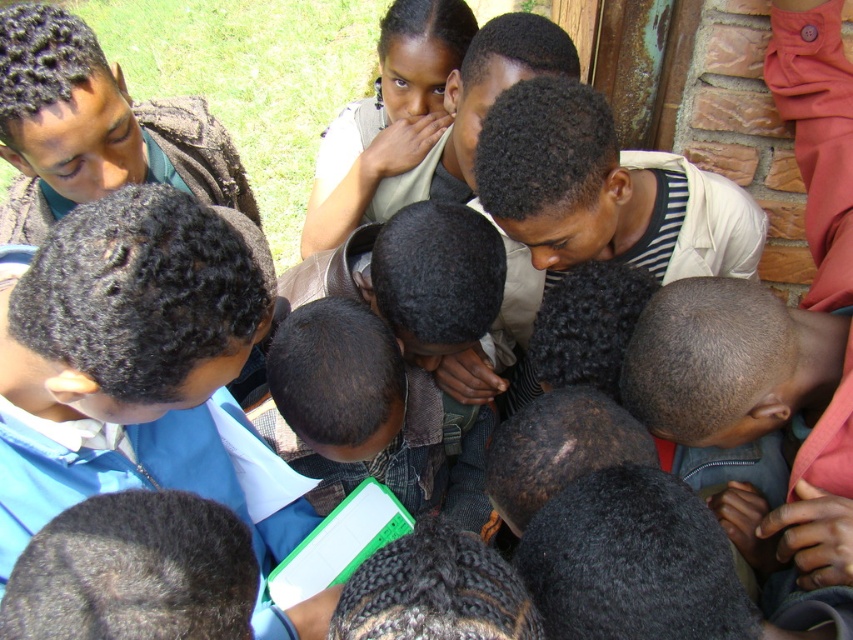
You are a photographer standing in front of the group. You want to take a photo that includes both the blue fabric shirt at center and the matte beige shirt at center. Which shirt should you focus on first to ensure both are in focus?

You should focus on the blue fabric shirt at center first because it is closer to the viewer than the matte beige shirt at center. By focusing on the closer object, the depth of field may include the farther one as well.

You are a photographer trying to capture a group photo of the blue fabric shirt at center and the matte beige shirt at center. Which shirt should you focus on to ensure it fills the frame more appropriately?

The blue fabric shirt at center is larger in size than the matte beige shirt at center, so focusing on the blue fabric shirt at center would ensure it fills the frame more appropriately.

You are a photographer trying to capture a group shot of the blue fabric shirt at center and the matte beige shirt at center. Since you want both shirts to be in the frame, which direction should you move your camera to ensure both are visible?

The blue fabric shirt at center is positioned on the left side of matte beige shirt at center, so you should move your camera slightly to the right to ensure both shirts are visible in the frame.